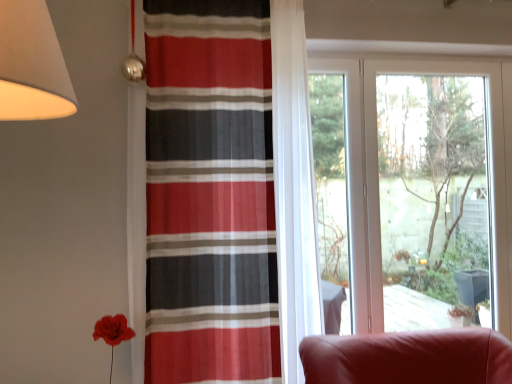
Question: Does transparent glass window at center contain striped fabric curtain at center?

Choices:
 (A) yes
 (B) no

Answer: (B)

Question: Is transparent glass window at center to the right of striped fabric curtain at center from the viewer's perspective?

Choices:
 (A) no
 (B) yes

Answer: (B)

Question: Is the position of transparent glass window at center less distant than that of striped fabric curtain at center?

Choices:
 (A) yes
 (B) no

Answer: (B)

Question: Is striped fabric curtain at center at the back of transparent glass window at center?

Choices:
 (A) no
 (B) yes

Answer: (A)

Question: Is transparent glass window at center oriented towards striped fabric curtain at center?

Choices:
 (A) yes
 (B) no

Answer: (B)

Question: From the image's perspective, is transparent glass window at center under striped fabric curtain at center?

Choices:
 (A) yes
 (B) no

Answer: (A)

Question: Can you confirm if striped fabric curtain at center is shorter than transparent glass window at center?

Choices:
 (A) no
 (B) yes

Answer: (A)

Question: Is the depth of striped fabric curtain at center greater than that of transparent glass window at center?

Choices:
 (A) yes
 (B) no

Answer: (B)

Question: Can transparent glass window at center be found inside striped fabric curtain at center?

Choices:
 (A) yes
 (B) no

Answer: (B)

Question: Can you confirm if striped fabric curtain at center is thinner than transparent glass window at center?

Choices:
 (A) no
 (B) yes

Answer: (A)

Question: From the image's perspective, does striped fabric curtain at center appear lower than transparent glass window at center?

Choices:
 (A) yes
 (B) no

Answer: (B)

Question: Is striped fabric curtain at center closer to the viewer compared to transparent glass window at center?

Choices:
 (A) yes
 (B) no

Answer: (A)

Question: Is striped fabric curtain at center to the left or to the right of transparent glass window at center in the image?

Choices:
 (A) right
 (B) left

Answer: (B)